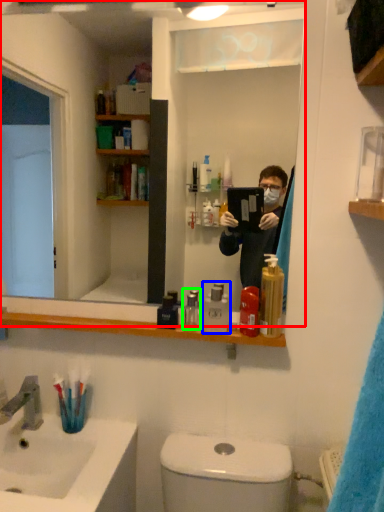
Question: Which object is positioned farthest from mirror (highlighted by a red box)? Select from mouthwash (highlighted by a blue box) and mouthwash (highlighted by a green box).

Choices:
 (A) mouthwash
 (B) mouthwash

Answer: (A)